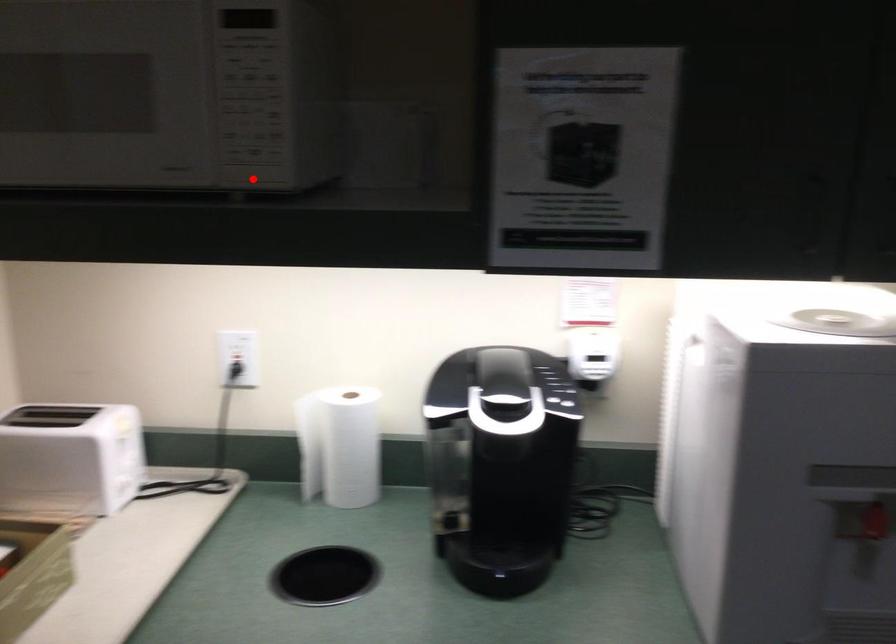
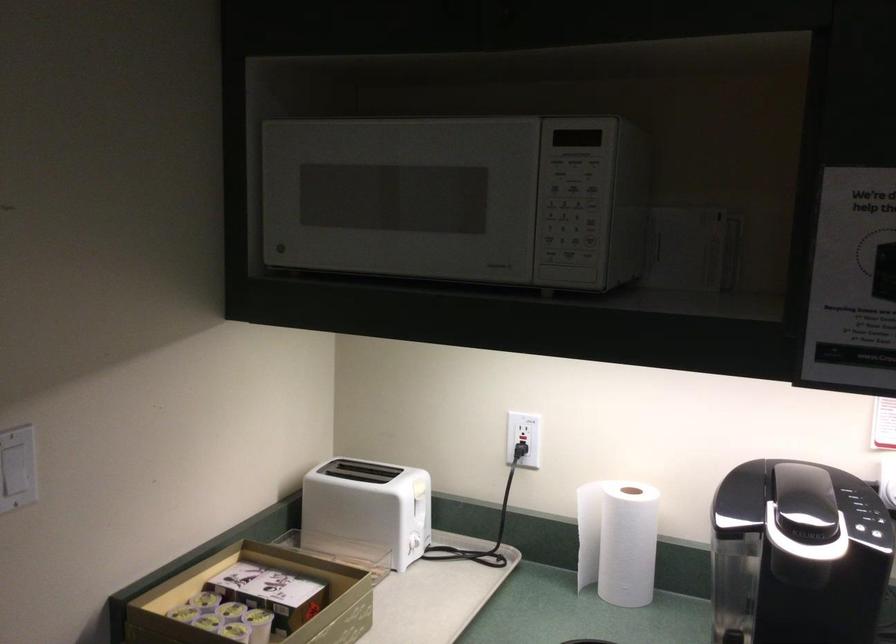
Where in the second image is the point corresponding to the highlighted location from the first image?

(565, 279)